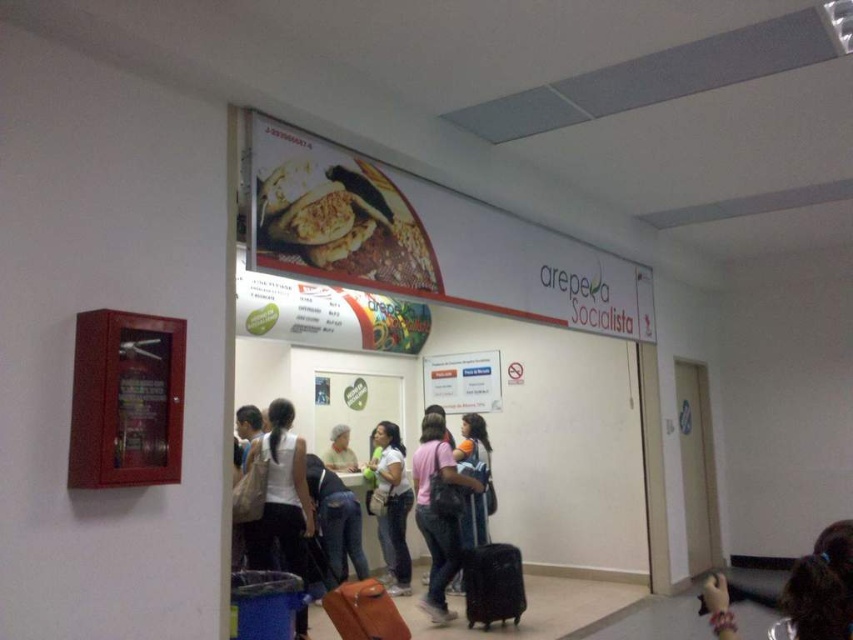
Between matte white shirt at center and jeans at center, which one is positioned higher?

jeans at center is above.

From the picture: Can you confirm if matte white shirt at center is positioned to the left of jeans at center?

Incorrect, matte white shirt at center is not on the left side of jeans at center.

Locate an element on the screen. This screenshot has height=640, width=853. matte white shirt at center is located at coordinates (390, 500).

Can you confirm if white fabric bag at lower center is thinner than jeans at center?

Yes, white fabric bag at lower center is thinner than jeans at center.

Does point (264, 528) lie behind point (312, 502)?

No, it is in front of (312, 502).

Where is `white fabric bag at lower center`? This screenshot has width=853, height=640. white fabric bag at lower center is located at coordinates (281, 497).

Locate an element on the screen. The image size is (853, 640). white fabric bag at lower center is located at coordinates (281, 497).

Does jeans at center appear over white matte headscarf at center?

Actually, jeans at center is below white matte headscarf at center.

Looking at this image, is jeans at center to the left of white matte headscarf at center from the viewer's perspective?

In fact, jeans at center is to the right of white matte headscarf at center.

Is point (350, 525) behind point (350, 460)?

No.

Locate an element on the screen. jeans at center is located at coordinates (335, 520).